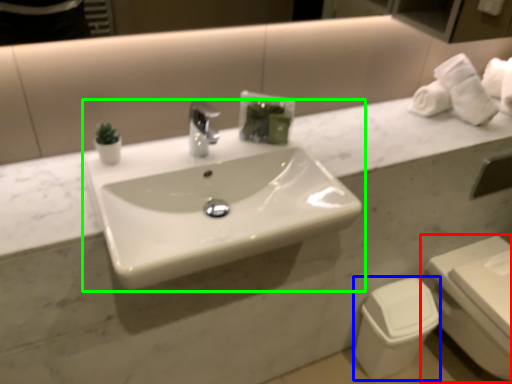
Question: Considering the real-world distances, which object is closest to toilet (highlighted by a red box)? toilet bowl (highlighted by a blue box) or sink (highlighted by a green box).

Choices:
 (A) toilet bowl
 (B) sink

Answer: (A)